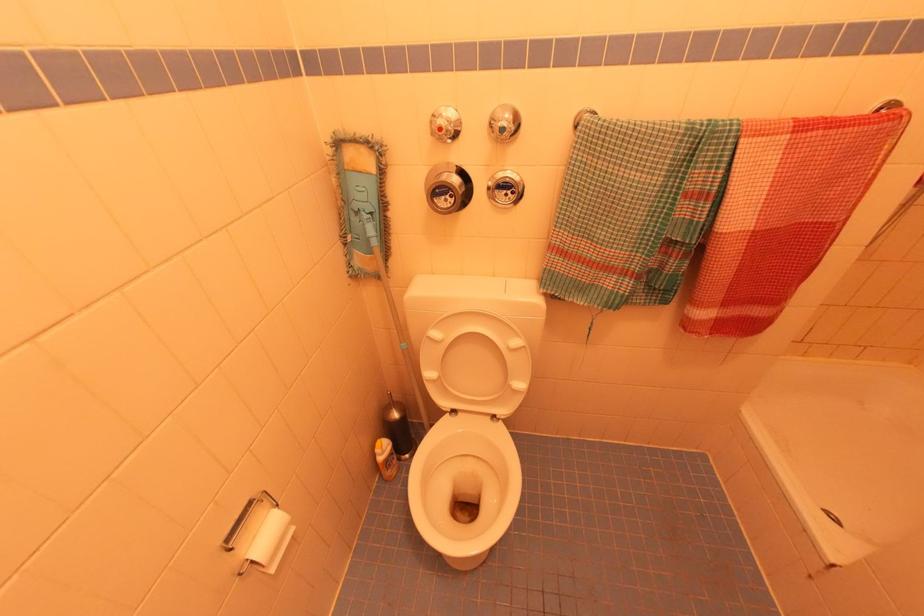
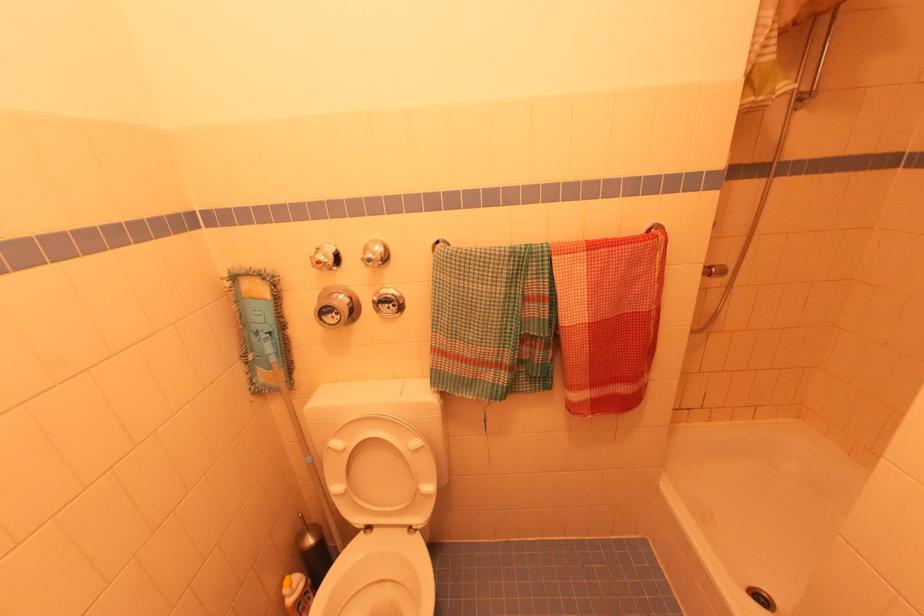
The point at (433,329) is marked in the first image. Where is the corresponding point in the second image?

(334, 439)